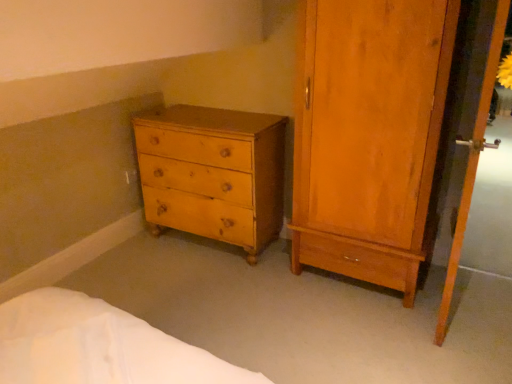
Question: Does point (331, 259) appear closer or farther from the camera than point (498, 0)?

Choices:
 (A) closer
 (B) farther

Answer: (B)

Question: Do you think matte wood wardrobe at right is within wooden screen door at right, or outside of it?

Choices:
 (A) outside
 (B) inside

Answer: (A)

Question: Which object is the closest to the matte wood wardrobe at right?

Choices:
 (A) wooden screen door at right
 (B) light brown wood chest of drawers at lower left

Answer: (A)

Question: Which object is the farthest from the light brown wood chest of drawers at lower left?

Choices:
 (A) matte wood wardrobe at right
 (B) wooden screen door at right

Answer: (B)